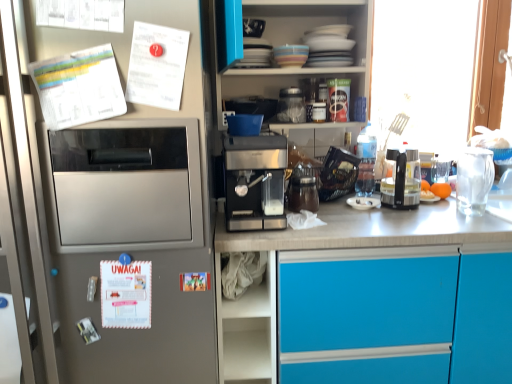
Where is `vacant region below black plastic coffee machine at center (from a real-world perspective)`? The width and height of the screenshot is (512, 384). vacant region below black plastic coffee machine at center (from a real-world perspective) is located at coordinates (407, 209).